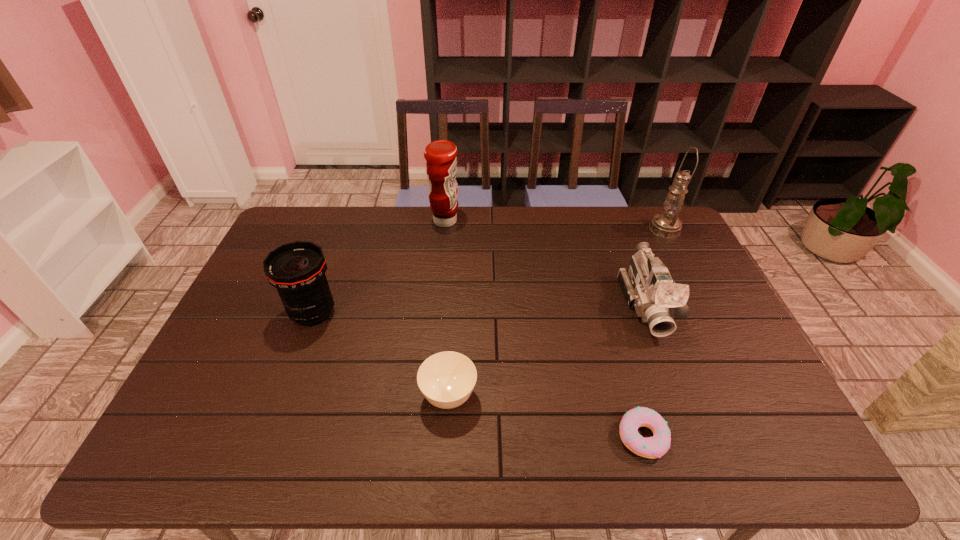
Where is `free space between the leftmost object and the sugar bowl`? This screenshot has width=960, height=540. free space between the leftmost object and the sugar bowl is located at coordinates (381, 355).

What are the coordinates of `free space between the shortest object and the telephoto lens` in the screenshot? It's located at (478, 375).

This screenshot has width=960, height=540. I want to click on object that is the fifth closest to the fifth tallest object, so click(667, 224).

Select which object appears as the fourth closest to the fifth object from left to right. Please provide its 2D coordinates. Your answer should be formatted as a tuple, i.e. [(x, y)], where the tuple contains the x and y coordinates of a point satisfying the conditions above.

[(441, 163)]